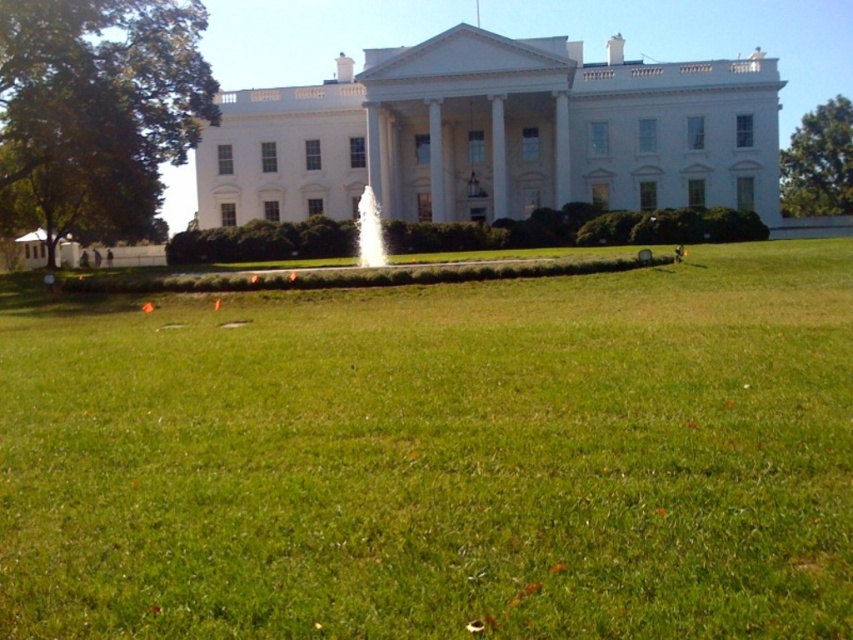
Can you confirm if green grass at center is thinner than white stone fountain at center?

Incorrect, green grass at center's width is not less than white stone fountain at center's.

Does point (438, 372) come closer to viewer compared to point (373, 248)?

Yes, point (438, 372) is closer to viewer.

I want to click on green grass at center, so click(437, 458).